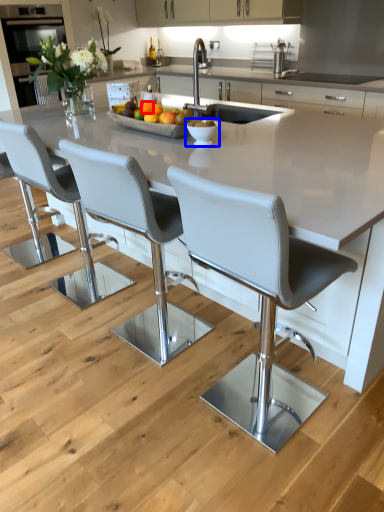
Question: Among these objects, which one is nearest to the camera, orange (highlighted by a red box) or bowl (highlighted by a blue box)?

Choices:
 (A) orange
 (B) bowl

Answer: (B)